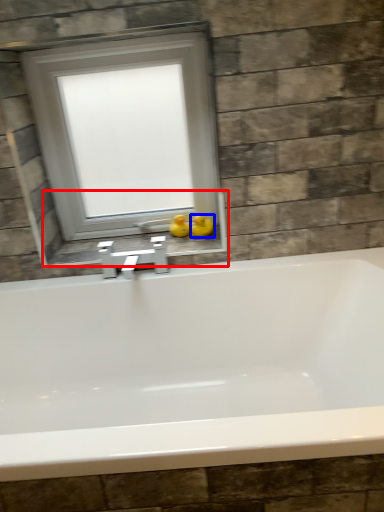
Question: Which point is further to the camera, window sill (highlighted by a red box) or duck (highlighted by a blue box)?

Choices:
 (A) window sill
 (B) duck

Answer: (B)